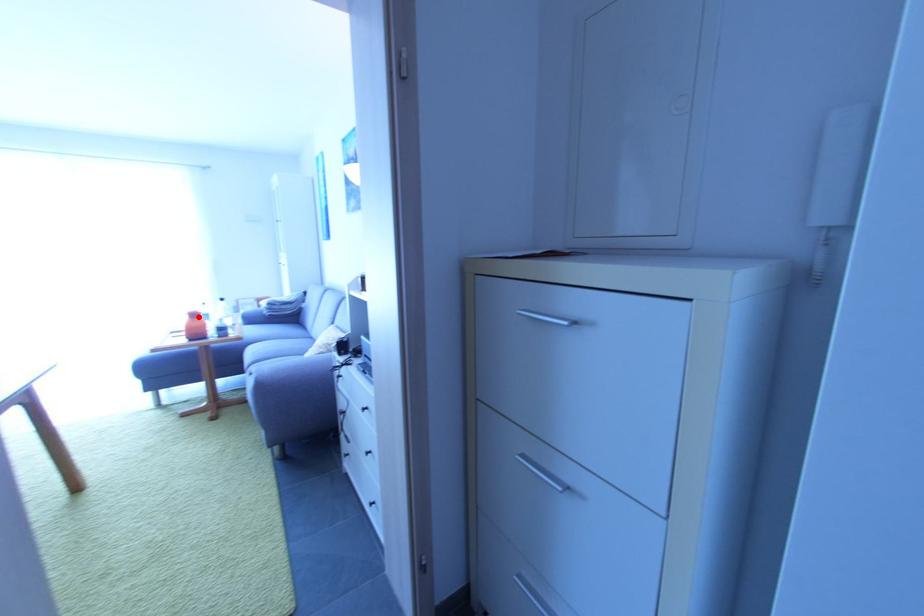
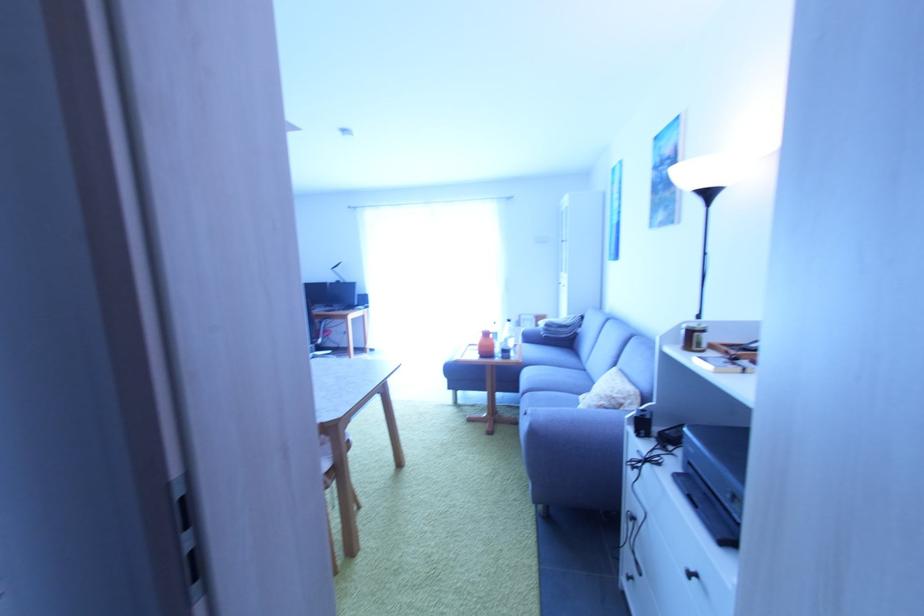
Question: I am providing you with two images of the same scene from different viewpoints. A red point is marked on the first image. Is the red point's position out of view in image 2?

Choices:
 (A) Yes
 (B) No

Answer: (B)